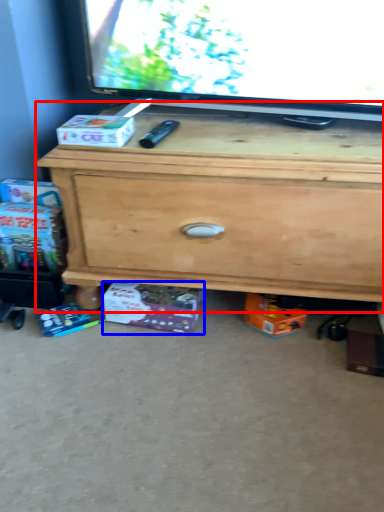
Question: Which object appears farthest to the camera in this image, chest of drawers (highlighted by a red box) or box (highlighted by a blue box)?

Choices:
 (A) chest of drawers
 (B) box

Answer: (B)